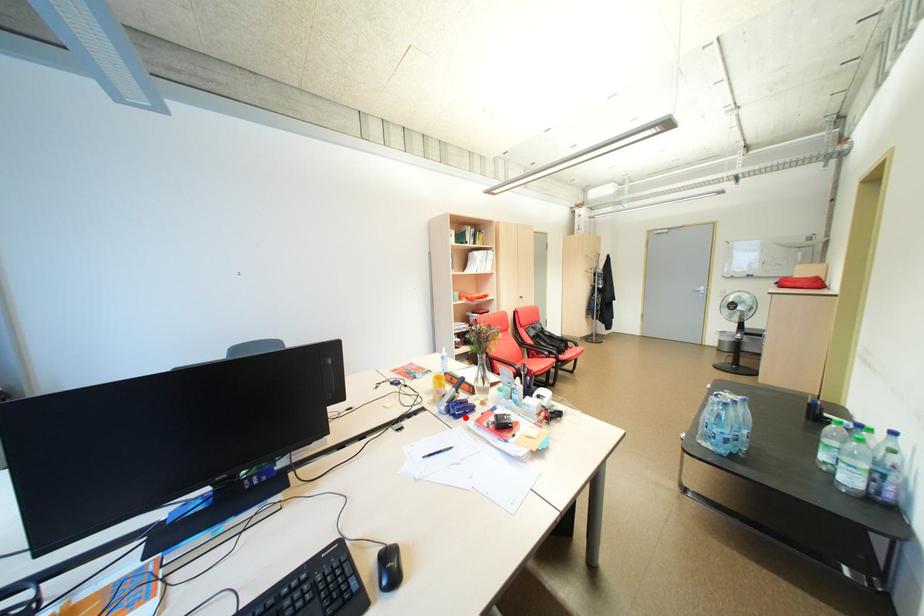
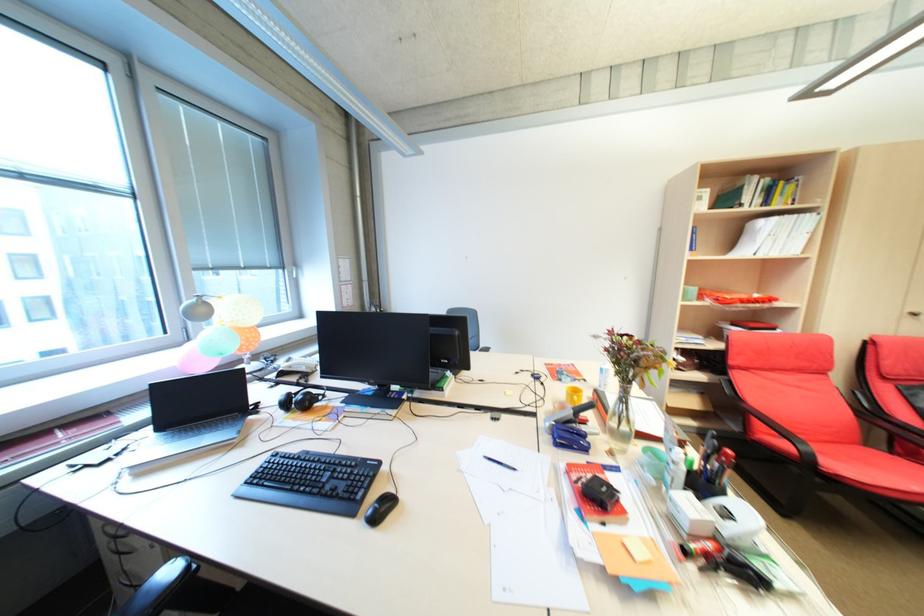
Where in the second image is the point corresponding to the highlighted location from the first image?

(565, 445)